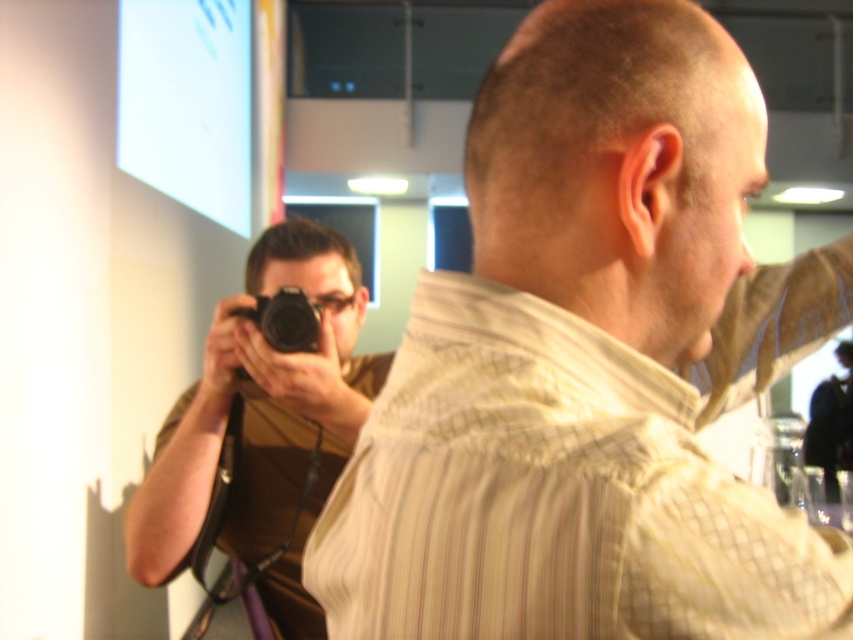
You are a photographer at the event and need to capture a photo of the light beige striped shirt at center without the black matte camera at center appearing in the frame. Can you do it based on their current positions?

The light beige striped shirt at center and black matte camera at center are 27.14 inches apart from each other. Since the distance between them is significant, you can position yourself or adjust the angle to exclude the black matte camera at center from the frame while focusing on the light beige striped shirt at center.

You are standing in the conference room and want to take a photo of the light beige striped shirt at center. Where should you aim your camera to capture it?

You should aim your camera at point 0.572 on the x axis and 0.693 on the y axis to capture the light beige striped shirt at center.

You are standing in the room and want to take a photo of the light beige striped shirt at center and the black plastic camera at center. Which object should you focus on first if you want to capture both in the same frame without moving the camera?

The light beige striped shirt at center is taller than the black plastic camera at center, so you should focus on the taller object first to ensure both fit in the frame.